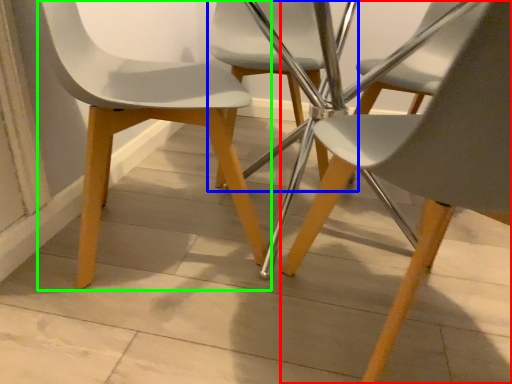
Question: Considering the real-world distances, which object is farthest from chair (highlighted by a red box)? chair (highlighted by a blue box) or chair (highlighted by a green box)?

Choices:
 (A) chair
 (B) chair

Answer: (A)